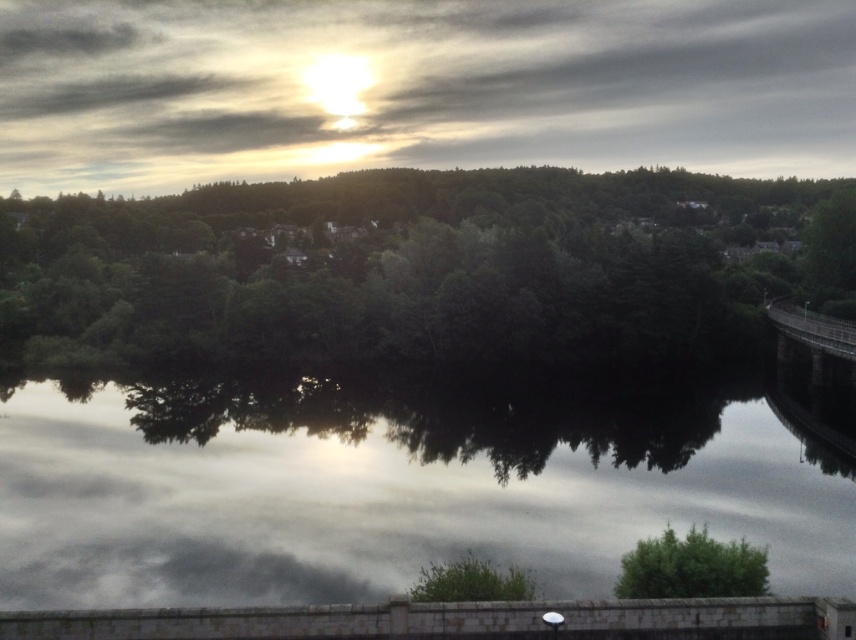
Is reflective glass water at center shorter than dark gray concrete bridge at right?

Yes, reflective glass water at center is shorter than dark gray concrete bridge at right.

Is reflective glass water at center in front of dark gray concrete bridge at right?

Yes, reflective glass water at center is closer to the viewer.

Which is in front, point (819, 563) or point (846, 330)?

Positioned in front is point (819, 563).

I want to click on reflective glass water at center, so click(387, 488).

Does reflective glass water at center have a lesser width compared to green leafy trees at center?

Yes, reflective glass water at center is thinner than green leafy trees at center.

Does reflective glass water at center come behind green leafy trees at center?

No, it is not.

What do you see at coordinates (387, 488) in the screenshot? The width and height of the screenshot is (856, 640). I see `reflective glass water at center` at bounding box center [387, 488].

Image resolution: width=856 pixels, height=640 pixels. Identify the location of reflective glass water at center. (387, 488).

Between green leafy tree at lower right and dark gray concrete bridge at right, which one appears on the left side from the viewer's perspective?

Positioned to the left is green leafy tree at lower right.

How far apart are green leafy tree at lower right and dark gray concrete bridge at right?

A distance of 73.40 meters exists between green leafy tree at lower right and dark gray concrete bridge at right.

Measure the distance between point (663, 592) and camera.

They are 20.08 meters apart.

Identify the location of green leafy tree at lower right. The height and width of the screenshot is (640, 856). (691, 566).